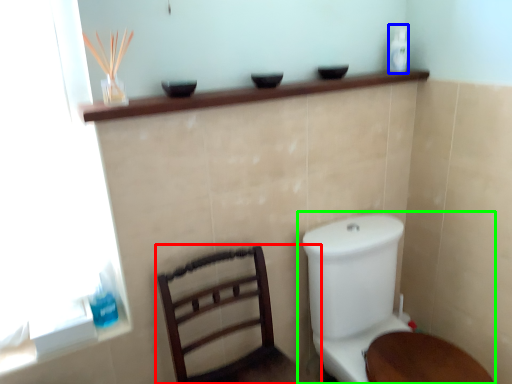
Question: Which is nearer to the furniture (highlighted by a red box)? toiletry (highlighted by a blue box) or toilet (highlighted by a green box).

Choices:
 (A) toiletry
 (B) toilet

Answer: (B)